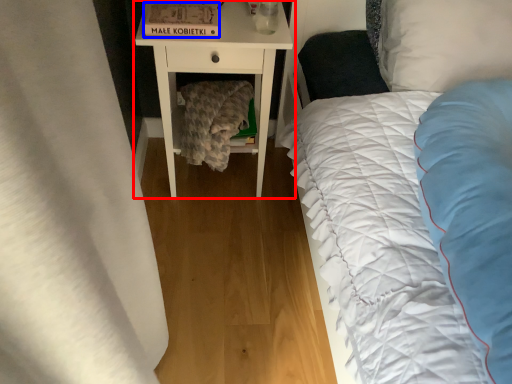
Question: Among these objects, which one is farthest to the camera, nightstand (highlighted by a red box) or cardboard box (highlighted by a blue box)?

Choices:
 (A) nightstand
 (B) cardboard box

Answer: (A)